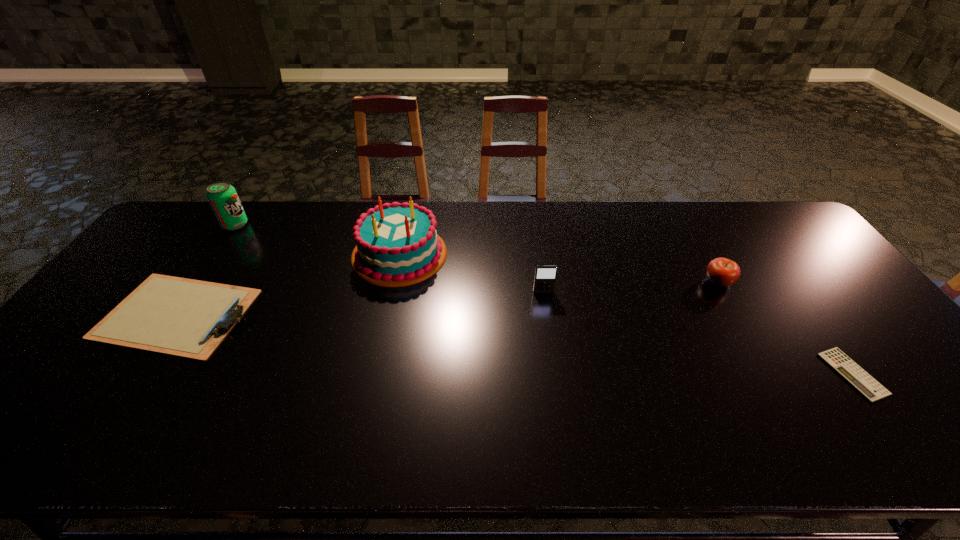
Find the location of `free location at the far edge of the desktop`. free location at the far edge of the desktop is located at coordinates (597, 227).

Find the location of a particular element. The image size is (960, 540). vacant space at the near edge is located at coordinates (908, 456).

The width and height of the screenshot is (960, 540). What are the coordinates of `vacant region at the right edge of the desktop` in the screenshot? It's located at (868, 364).

In the image, there is a desktop. Where is `blank space at the far right corner`? blank space at the far right corner is located at coordinates (759, 221).

This screenshot has width=960, height=540. Find the location of `unoccupied area between the third shortest object and the second tallest object`. unoccupied area between the third shortest object and the second tallest object is located at coordinates (x=477, y=253).

You are a GUI agent. You are given a task and a screenshot of the screen. Output one action in this format:
    pyautogui.click(x=<x>, y=<y>)
    Task: Click on the vacant space that's between the birthday cake and the second object from right to left
    The image size is (960, 540).
    Given the screenshot: What is the action you would take?
    tap(559, 268)

At what (x,y) coordinates should I click in order to perform the action: click on free space that is in between the iPod and the third shortest object. Please return your answer as a coordinate pair (x, y). The width and height of the screenshot is (960, 540). Looking at the image, I should click on (631, 287).

Where is `unoccupied area between the rightmost object and the fifth object from left to right`? The image size is (960, 540). unoccupied area between the rightmost object and the fifth object from left to right is located at coordinates (785, 328).

I want to click on vacant point located between the birthday cake and the third shortest object, so click(559, 268).

This screenshot has height=540, width=960. I want to click on vacant area that lies between the second object from right to left and the fifth tallest object, so click(x=447, y=298).